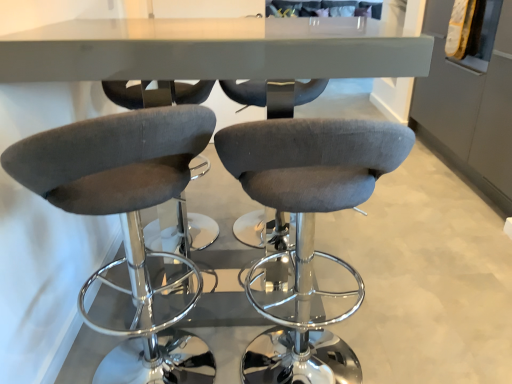
The image size is (512, 384). I want to click on dark gray fabric stool at left, the first chair from the left, so click(117, 179).

What do you see at coordinates (117, 179) in the screenshot? The image size is (512, 384). I see `dark gray fabric stool at left, which appears as the 2th chair when viewed from the right` at bounding box center [117, 179].

Locate an element on the screen. velvet grey stool at center, the second chair viewed from the left is located at coordinates (308, 226).

Measure the distance between velvet grey stool at center, the second chair viewed from the left, and camera.

velvet grey stool at center, the second chair viewed from the left, is 1.42 meters away from camera.

Describe the element at coordinates (308, 226) in the screenshot. This screenshot has width=512, height=384. I see `velvet grey stool at center, which ranks as the first chair in right-to-left order` at that location.

Locate an element on the screen. The height and width of the screenshot is (384, 512). dark gray fabric stool at left, the first chair from the left is located at coordinates (117, 179).

Visually, is dark gray fabric stool at left, which appears as the 2th chair when viewed from the right, positioned to the left or to the right of velvet grey stool at center, which ranks as the first chair in right-to-left order?

dark gray fabric stool at left, which appears as the 2th chair when viewed from the right, is positioned on velvet grey stool at center, which ranks as the first chair in right-to-left order,'s left side.

Who is more distant, dark gray fabric stool at left, which appears as the 2th chair when viewed from the right, or velvet grey stool at center, which ranks as the first chair in right-to-left order?

Positioned behind is velvet grey stool at center, which ranks as the first chair in right-to-left order.

Does point (106, 125) come behind point (286, 348)?

No.

From the image's perspective, is dark gray fabric stool at left, which appears as the 2th chair when viewed from the right, positioned above or below velvet grey stool at center, the second chair viewed from the left?

Based on their image positions, dark gray fabric stool at left, which appears as the 2th chair when viewed from the right, is located beneath velvet grey stool at center, the second chair viewed from the left.

Looking at this image, from a real-world perspective, which is physically below, dark gray fabric stool at left, which appears as the 2th chair when viewed from the right, or velvet grey stool at center, which ranks as the first chair in right-to-left order?

velvet grey stool at center, which ranks as the first chair in right-to-left order, is physically lower.

Based on the photo, looking at their sizes, would you say dark gray fabric stool at left, the first chair from the left, is wider or thinner than velvet grey stool at center, the second chair viewed from the left?

Considering their sizes, dark gray fabric stool at left, the first chair from the left, looks broader than velvet grey stool at center, the second chair viewed from the left.

Which of these two, dark gray fabric stool at left, which appears as the 2th chair when viewed from the right, or velvet grey stool at center, which ranks as the first chair in right-to-left order, stands taller?

dark gray fabric stool at left, which appears as the 2th chair when viewed from the right.

Between dark gray fabric stool at left, the first chair from the left, and velvet grey stool at center, the second chair viewed from the left, which one has smaller size?

With smaller size is velvet grey stool at center, the second chair viewed from the left.

Which is correct: dark gray fabric stool at left, which appears as the 2th chair when viewed from the right, is inside velvet grey stool at center, the second chair viewed from the left, or outside of it?

dark gray fabric stool at left, which appears as the 2th chair when viewed from the right, lies outside velvet grey stool at center, the second chair viewed from the left.

Is dark gray fabric stool at left, the first chair from the left, next to velvet grey stool at center, the second chair viewed from the left?

dark gray fabric stool at left, the first chair from the left, and velvet grey stool at center, the second chair viewed from the left, are not in contact.

Is dark gray fabric stool at left, which appears as the 2th chair when viewed from the right, oriented away from velvet grey stool at center, which ranks as the first chair in right-to-left order?

dark gray fabric stool at left, which appears as the 2th chair when viewed from the right, is not turned away from velvet grey stool at center, which ranks as the first chair in right-to-left order.

Find the location of a particular element. chair that is below the velvet grey stool at center, which ranks as the first chair in right-to-left order (from the image's perspective) is located at coordinates click(x=117, y=179).

Which is more to the right, velvet grey stool at center, the second chair viewed from the left, or dark gray fabric stool at left, which appears as the 2th chair when viewed from the right?

velvet grey stool at center, the second chair viewed from the left.

Is velvet grey stool at center, the second chair viewed from the left, positioned in front of dark gray fabric stool at left, the first chair from the left?

No, velvet grey stool at center, the second chair viewed from the left, is behind dark gray fabric stool at left, the first chair from the left.

Considering the points (255, 155) and (174, 186), which point is in front, point (255, 155) or point (174, 186)?

Point (255, 155)

From the image's perspective, which one is positioned higher, velvet grey stool at center, the second chair viewed from the left, or dark gray fabric stool at left, the first chair from the left?

velvet grey stool at center, the second chair viewed from the left, is shown above in the image.

From a real-world perspective, is velvet grey stool at center, the second chair viewed from the left, above or below dark gray fabric stool at left, the first chair from the left?

In terms of real-world spatial position, velvet grey stool at center, the second chair viewed from the left, is below dark gray fabric stool at left, the first chair from the left.

Between velvet grey stool at center, which ranks as the first chair in right-to-left order, and dark gray fabric stool at left, the first chair from the left, which one has larger width?

dark gray fabric stool at left, the first chair from the left.

Which of these two, velvet grey stool at center, the second chair viewed from the left, or dark gray fabric stool at left, which appears as the 2th chair when viewed from the right, stands taller?

With more height is dark gray fabric stool at left, which appears as the 2th chair when viewed from the right.

Which of these two, velvet grey stool at center, which ranks as the first chair in right-to-left order, or dark gray fabric stool at left, which appears as the 2th chair when viewed from the right, is smaller?

With smaller size is velvet grey stool at center, which ranks as the first chair in right-to-left order.

Can we say velvet grey stool at center, which ranks as the first chair in right-to-left order, lies outside dark gray fabric stool at left, the first chair from the left?

Yes.

Is velvet grey stool at center, the second chair viewed from the left, next to dark gray fabric stool at left, which appears as the 2th chair when viewed from the right, and touching it?

No, velvet grey stool at center, the second chair viewed from the left, is not in contact with dark gray fabric stool at left, which appears as the 2th chair when viewed from the right.

Is dark gray fabric stool at left, which appears as the 2th chair when viewed from the right, at the back of velvet grey stool at center, the second chair viewed from the left?

No.

How different are the orientations of velvet grey stool at center, which ranks as the first chair in right-to-left order, and dark gray fabric stool at left, which appears as the 2th chair when viewed from the right, in degrees?

3.71e-05 degrees separate the facing orientations of velvet grey stool at center, which ranks as the first chair in right-to-left order, and dark gray fabric stool at left, which appears as the 2th chair when viewed from the right.

Measure the distance between velvet grey stool at center, the second chair viewed from the left, and dark gray fabric stool at left, which appears as the 2th chair when viewed from the right.

They are 35.15 inches apart.

Find the location of `chair above the velvet grey stool at center, the second chair viewed from the left (from a real-world perspective)`. chair above the velvet grey stool at center, the second chair viewed from the left (from a real-world perspective) is located at coordinates (117, 179).

Find the location of a particular element. The image size is (512, 384). chair on the right of dark gray fabric stool at left, which appears as the 2th chair when viewed from the right is located at coordinates (308, 226).

Locate an element on the screen. The width and height of the screenshot is (512, 384). chair lying on the left of velvet grey stool at center, which ranks as the first chair in right-to-left order is located at coordinates (117, 179).